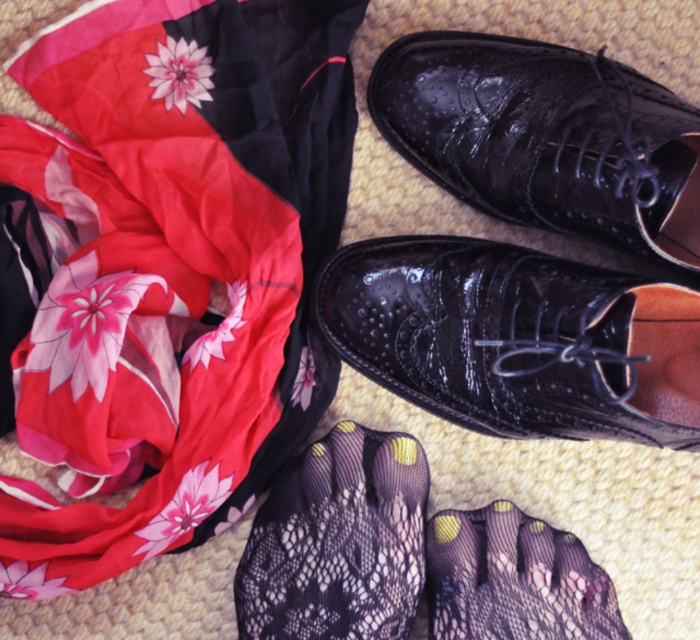
You are organizing a closet and need to place the black lace foot at lower right and the black mesh sock at lower center into a drawer. The drawer has limited space. Which item should you place first to ensure both fit comfortably?

You should place the black mesh sock at lower center first since it is smaller in size than the black lace foot at lower right, allowing the larger item to be placed on top or beside it without overcrowding the drawer.

From the picture: You are organizing a closet and need to place the black lace foot at lower right and the black mesh sock at lower center. Based on their positions in the image, which one is closer to the front of the closet?

The black lace foot at lower right is closer to the front of the closet because it is in front of the black mesh sock at lower center.

You are trying to put on your shoes but notice the glossy leather shoe at center and the black mesh sock at lower center. Which item should you put on first according to proper footwear etiquette?

You should put on the black mesh sock at lower center first before the glossy leather shoe at center, as socks are typically worn under shoes to protect the feet and the shoe lining.